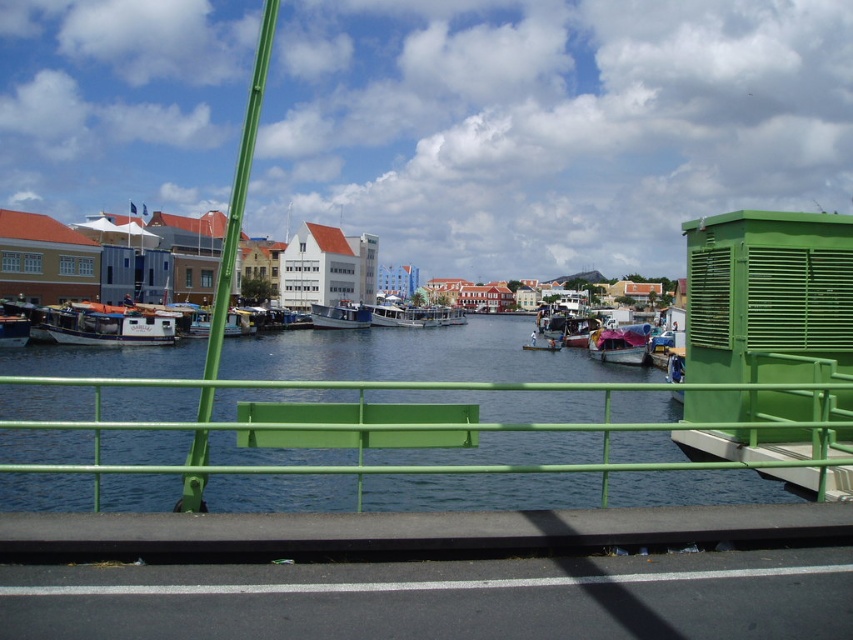
Question: Considering the relative positions of green matte bench at center and metallic silver boat at left in the image provided, where is green matte bench at center located with respect to metallic silver boat at left?

Choices:
 (A) left
 (B) right

Answer: (B)

Question: Is metallic silver boat at center closer to camera compared to white wooden boat at center?

Choices:
 (A) no
 (B) yes

Answer: (A)

Question: Estimate the real-world distances between objects in this image. Which object is closer to the white matte boat at left?

Choices:
 (A) green matte bench at center
 (B) white glossy boat at center
 (C) white wooden boat at center
 (D) metallic pink boat at center

Answer: (C)

Question: Which object is the closest to the metallic pink boat at center?

Choices:
 (A) green matte bench at center
 (B) metallic silver boat at center
 (C) white wooden boat at center

Answer: (A)

Question: Which object is positioned closest to the metallic silver boat at center?

Choices:
 (A) metallic pink boat at center
 (B) white glossy boat at center
 (C) metallic silver boat at left
 (D) green matte bench at center

Answer: (B)

Question: Can you confirm if green matte bench at center is positioned below metallic pink boat at center?

Choices:
 (A) no
 (B) yes

Answer: (B)